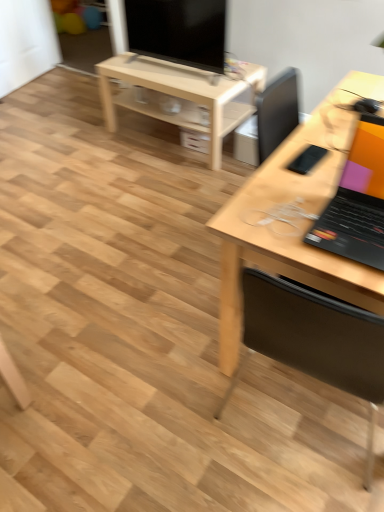
Question: Is matte black tv at upper center thinner than wooden chair at right?

Choices:
 (A) no
 (B) yes

Answer: (B)

Question: Is matte black tv at upper center bigger than wooden chair at right?

Choices:
 (A) no
 (B) yes

Answer: (A)

Question: Can you confirm if matte black tv at upper center is shorter than wooden chair at right?

Choices:
 (A) no
 (B) yes

Answer: (B)

Question: Considering the relative positions of matte black tv at upper center and wooden chair at right in the image provided, is matte black tv at upper center behind wooden chair at right?

Choices:
 (A) yes
 (B) no

Answer: (A)

Question: From the image's perspective, is matte black tv at upper center beneath wooden chair at right?

Choices:
 (A) no
 (B) yes

Answer: (A)

Question: Would you say wooden chair at right is to the left or to the right of light wood desk at right in the picture?

Choices:
 (A) left
 (B) right

Answer: (A)

Question: In the image, is wooden chair at right positioned in front of or behind light wood desk at right?

Choices:
 (A) behind
 (B) front

Answer: (B)

Question: From their relative heights in the image, would you say wooden chair at right is taller or shorter than light wood desk at right?

Choices:
 (A) short
 (B) tall

Answer: (B)

Question: Do you think wooden chair at right is within light wood desk at right, or outside of it?

Choices:
 (A) inside
 (B) outside

Answer: (A)

Question: Is point (332, 355) closer or farther from the camera than point (230, 115)?

Choices:
 (A) closer
 (B) farther

Answer: (A)

Question: Is wooden chair at right situated inside light wood/unfinished table at center or outside?

Choices:
 (A) inside
 (B) outside

Answer: (B)

Question: From a real-world perspective, is wooden chair at right physically located above or below light wood/unfinished table at center?

Choices:
 (A) below
 (B) above

Answer: (B)

Question: Is wooden chair at right taller or shorter than light wood/unfinished table at center?

Choices:
 (A) tall
 (B) short

Answer: (A)

Question: Is light wood/unfinished table at center situated inside wooden chair at right or outside?

Choices:
 (A) outside
 (B) inside

Answer: (A)

Question: Considering their positions, is light wood/unfinished table at center located in front of or behind wooden chair at right?

Choices:
 (A) front
 (B) behind

Answer: (B)